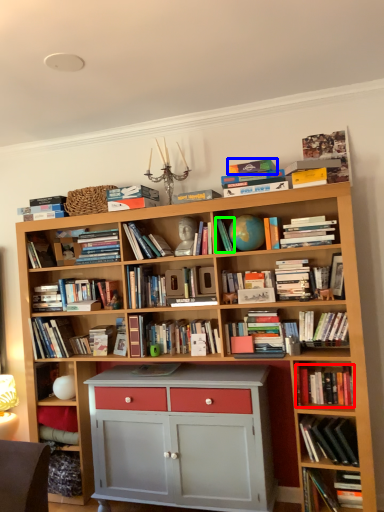
Question: Based on their relative distances, which object is nearer to book (highlighted by a red box)? Choose from paperback book (highlighted by a blue box) and book (highlighted by a green box).

Choices:
 (A) paperback book
 (B) book

Answer: (B)